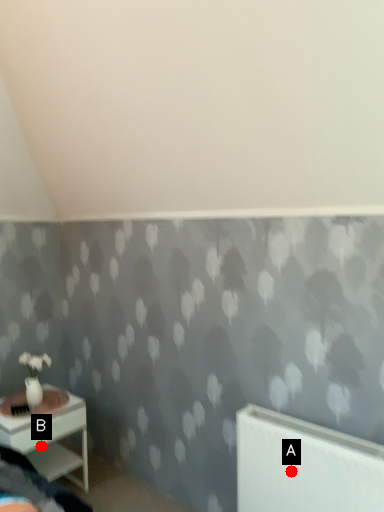
Question: Two points are circled on the image, labeled by A and B beside each circle. Which point is closer to the camera taking this photo?

Choices:
 (A) A is closer
 (B) B is closer

Answer: (A)